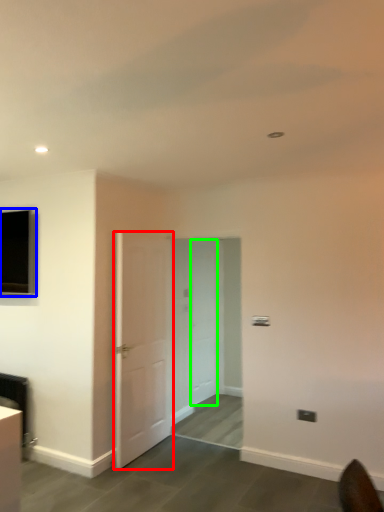
Question: Estimate the real-world distances between objects in this image. Which object is farther from door (highlighted by a red box), window (highlighted by a blue box) or door (highlighted by a green box)?

Choices:
 (A) window
 (B) door

Answer: (B)